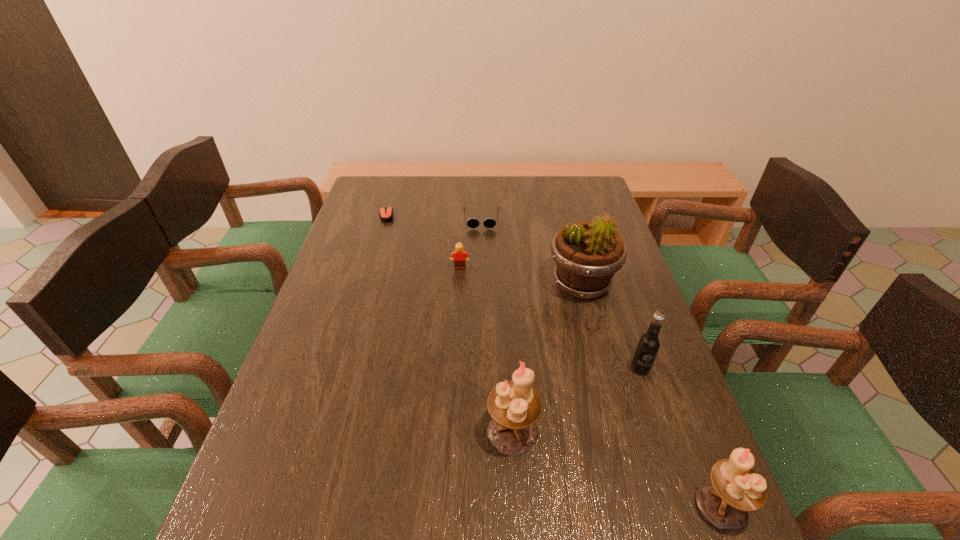
Where is `object that is positioned at the left edge`? object that is positioned at the left edge is located at coordinates (386, 213).

I want to click on candle holder present at the right edge, so click(x=735, y=488).

Identify the location of root beer present at the right edge. The image size is (960, 540). (648, 345).

Locate an element on the screen. This screenshot has height=540, width=960. flowerpot located at the right edge is located at coordinates (587, 254).

Where is `object that is at the far left corner`? object that is at the far left corner is located at coordinates (386, 213).

The height and width of the screenshot is (540, 960). Identify the location of object at the near right corner. (735, 488).

What are the coordinates of `vacant space at the far edge of the desktop` in the screenshot? It's located at (407, 182).

This screenshot has height=540, width=960. I want to click on free space at the near edge of the desktop, so click(x=503, y=467).

This screenshot has width=960, height=540. Identify the location of vacant area at the left edge of the desktop. (375, 220).

You are a GUI agent. You are given a task and a screenshot of the screen. Output one action in this format:
    pyautogui.click(x=<x>, y=<y>)
    Task: Click on the vacant space at the right edge
    The image size is (960, 540).
    Given the screenshot: What is the action you would take?
    pyautogui.click(x=660, y=348)